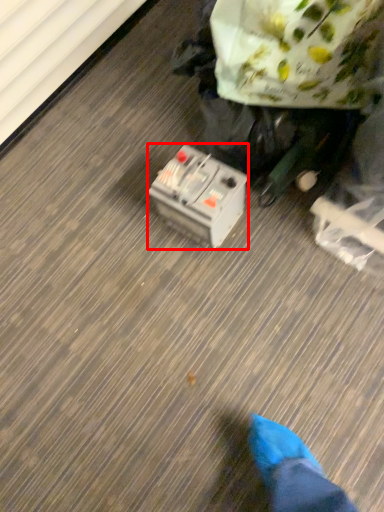
Question: In this image, where is equipment (annotated by the red box) located relative to paper bag?

Choices:
 (A) left
 (B) right

Answer: (A)